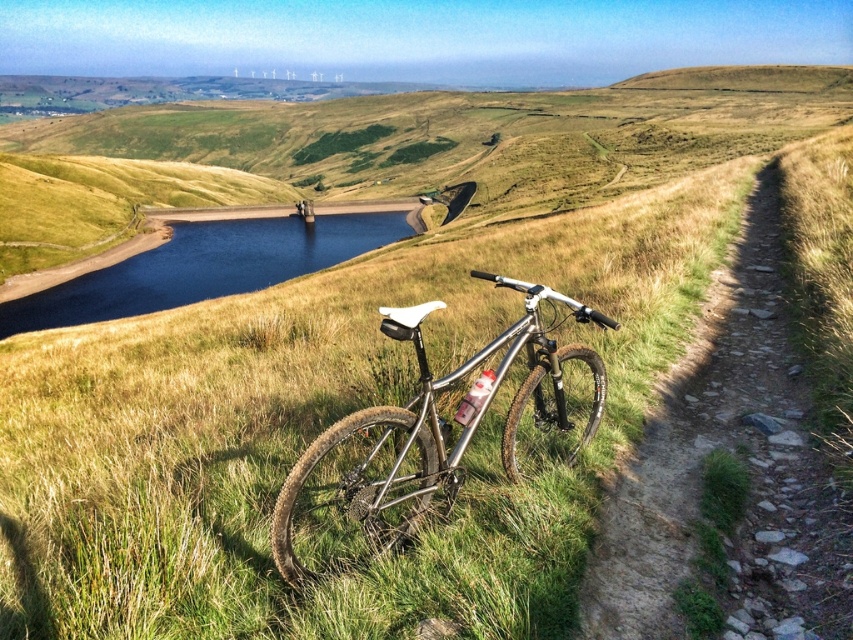
Which is in front, point (698, 548) or point (548, 444)?

Point (698, 548) is in front.

Does dirt path at center-right have a lesser height compared to silver metallic mountain bike at center?

In fact, dirt path at center-right may be taller than silver metallic mountain bike at center.

Is point (671, 625) behind point (407, 513)?

No, (671, 625) is in front of (407, 513).

Find the location of `dirt path at center-right`. dirt path at center-right is located at coordinates (732, 458).

Is silver metallic mountain bike at center closer to the viewer compared to smooth dark blue water at center?

Yes, silver metallic mountain bike at center is closer to the viewer.

Between point (347, 564) and point (57, 291), which one is positioned in front?

Point (347, 564) is more forward.

You are a GUI agent. You are given a task and a screenshot of the screen. Output one action in this format:
    pyautogui.click(x=<x>, y=<y>)
    Task: Click on the silver metallic mountain bike at center
    The width and height of the screenshot is (853, 640).
    Given the screenshot: What is the action you would take?
    pyautogui.click(x=434, y=440)

How far apart are dirt path at center-right and smooth dark blue water at center?

dirt path at center-right is 53.84 meters from smooth dark blue water at center.

Which is in front, point (618, 637) or point (245, 264)?

Positioned in front is point (618, 637).

Locate an element on the screen. This screenshot has height=640, width=853. dirt path at center-right is located at coordinates (732, 458).